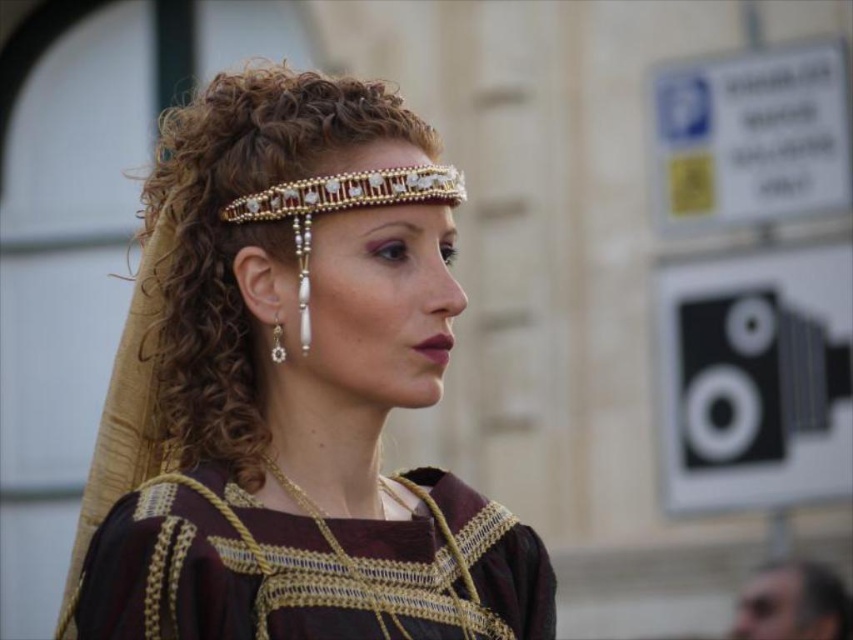
What object is located at the coordinates point (291, 390) in the image?

The point (291, 390) indicates the matte gold headband at center.

You are a costume designer preparing for a play. You need to ensure that the matte gold headband at center and the burgundy fabric dress at center are proportionate. Based on the image, which object has a greater width?

The matte gold headband at center has a greater width than the burgundy fabric dress at center.